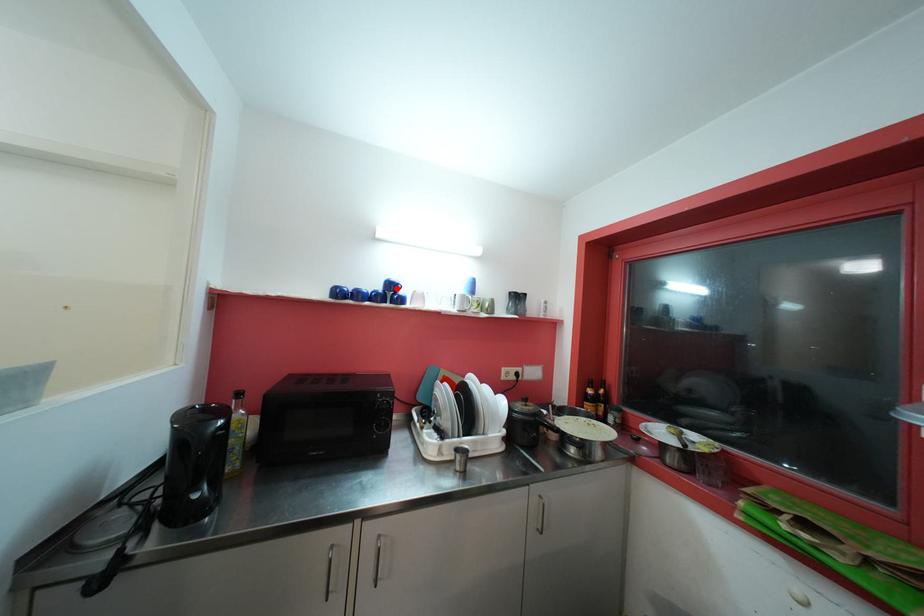
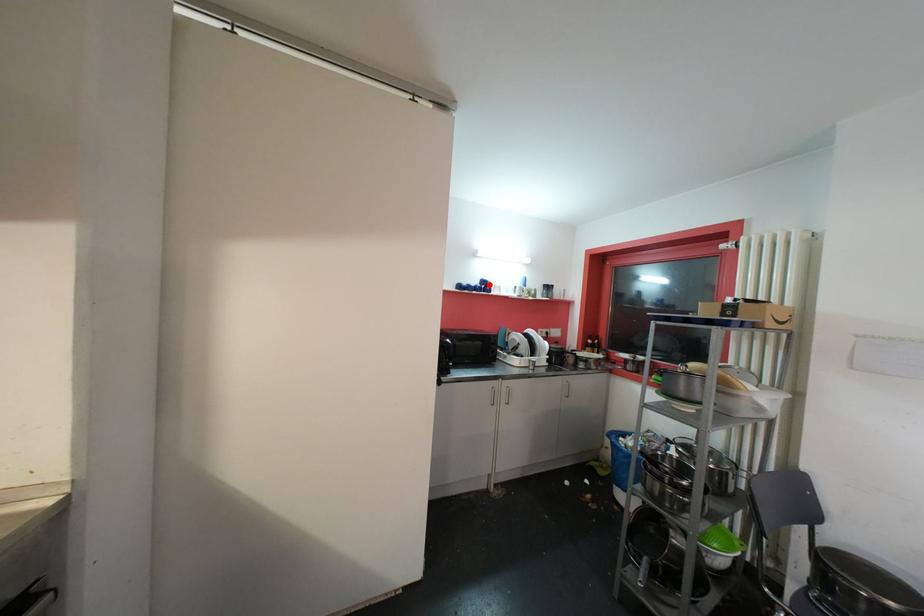
I am providing you with two images of the same scene from different viewpoints. A red point is marked on the first image and another point is marked on the second image. Does the point marked in image1 correspond to the same location as the one in image2?

Yes